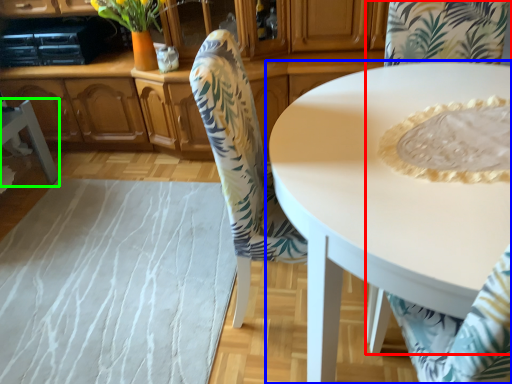
Question: Estimate the real-world distances between objects in this image. Which object is farther from chair (highlighted by a red box), coffee table (highlighted by a blue box) or chair (highlighted by a green box)?

Choices:
 (A) coffee table
 (B) chair

Answer: (B)